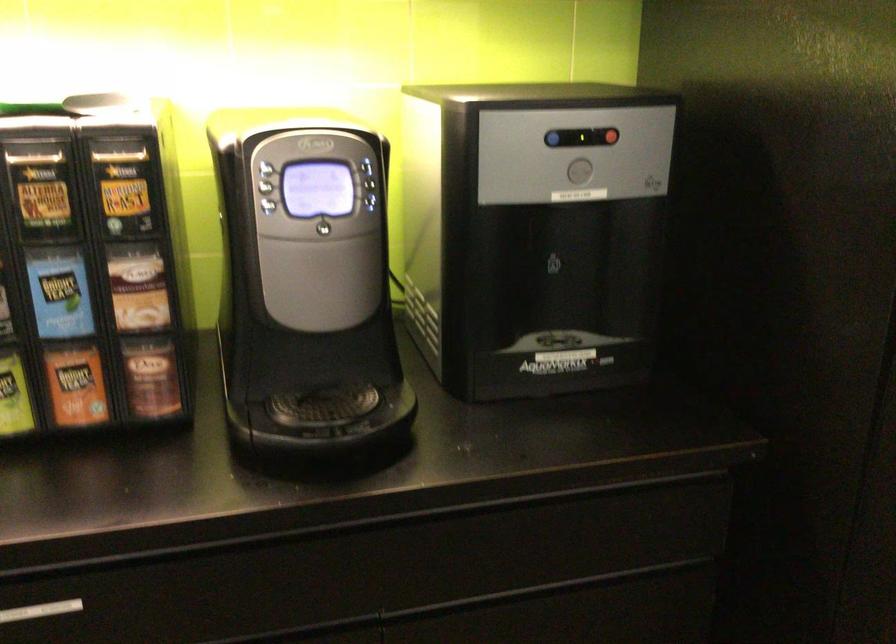
The width and height of the screenshot is (896, 644). Find the location of `blue dispenser button`. blue dispenser button is located at coordinates 552,138.